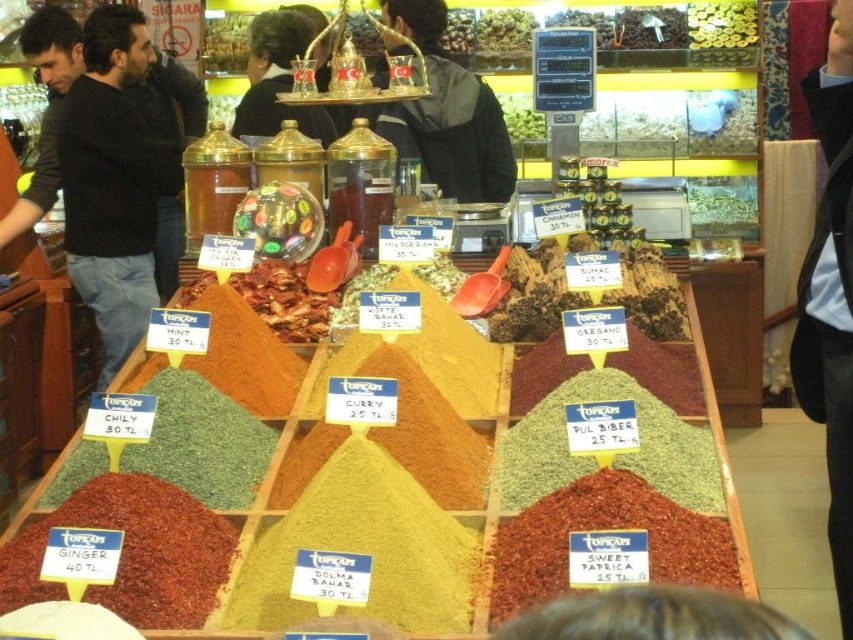
Identify the location of brown woody sticks at center. (532, 294).

Does point (498, 337) come behind point (526, 93)?

No, (498, 337) is closer to viewer.

Between point (605, 305) and point (538, 128), which one is positioned behind?

The point (538, 128) is behind.

You are a GUI agent. You are given a task and a screenshot of the screen. Output one action in this format:
    pyautogui.click(x=<x>, y=<y>)
    Task: Click on the brown woody sticks at center
    The height and width of the screenshot is (640, 853).
    Given the screenshot: What is the action you would take?
    pyautogui.click(x=532, y=294)

This screenshot has width=853, height=640. Describe the element at coordinates (616, 456) in the screenshot. I see `green powder spice at center` at that location.

Is green powder spice at center smaller than green leafy vegetable at center?

Actually, green powder spice at center might be larger than green leafy vegetable at center.

Who is more forward, (663,420) or (711,224)?

Point (663,420) is more forward.

The height and width of the screenshot is (640, 853). Find the location of `green powder spice at center`. green powder spice at center is located at coordinates (616, 456).

Does green leafy vegetable at center come in front of green leafy vegetables at center?

No, it is not.

Is green leafy vegetable at center wider than green leafy vegetables at center?

Indeed, green leafy vegetable at center has a greater width compared to green leafy vegetables at center.

Where is `green leafy vegetable at center`? The image size is (853, 640). green leafy vegetable at center is located at coordinates (722, 202).